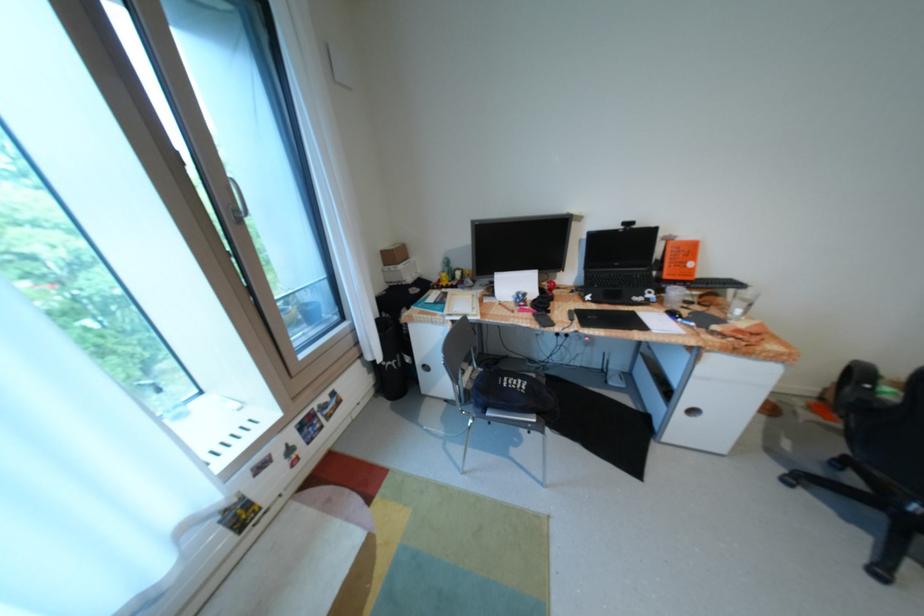
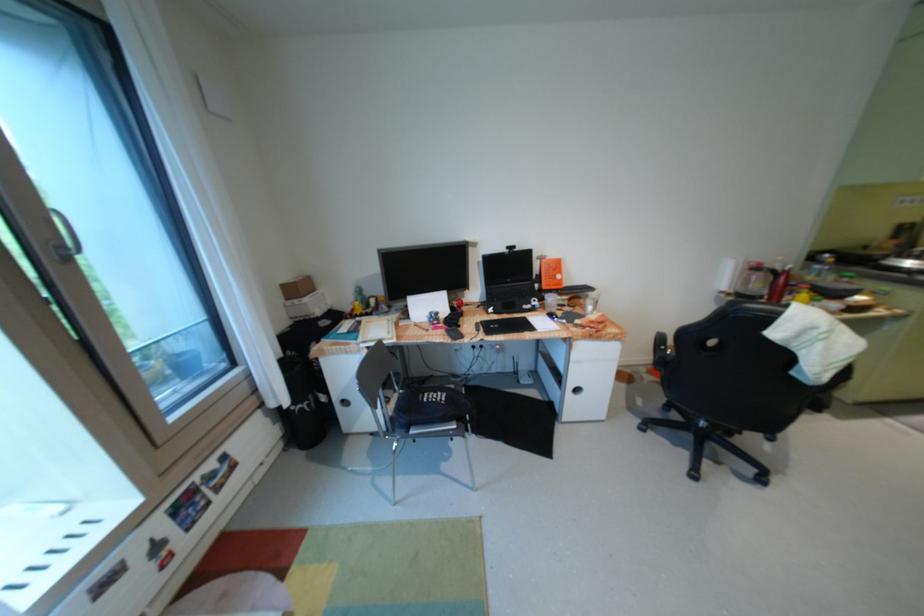
In the second image, find the point that corresponds to [526,379] in the first image.

(445, 392)